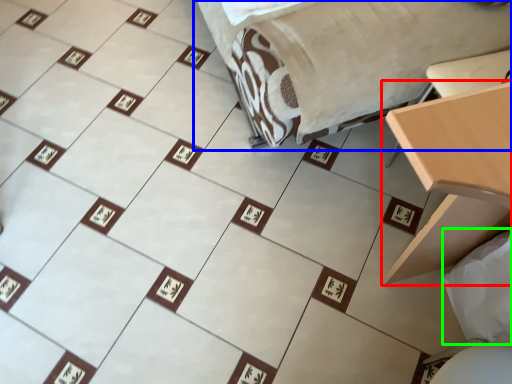
Question: Which object is the farthest from table (highlighted by a red box)? Choose among these: furniture (highlighted by a blue box) or sheet (highlighted by a green box).

Choices:
 (A) furniture
 (B) sheet

Answer: (A)